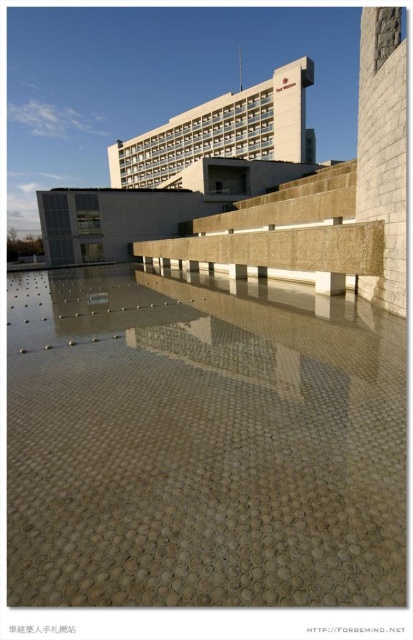
Can you confirm if translucent glass mosaic at center is wider than beige stone plaza at upper center?

No.

Is translucent glass mosaic at center smaller than beige stone plaza at upper center?

Correct, translucent glass mosaic at center occupies less space than beige stone plaza at upper center.

Where is `translucent glass mosaic at center`? The height and width of the screenshot is (640, 413). translucent glass mosaic at center is located at coordinates (199, 449).

Find the location of a particular element. translucent glass mosaic at center is located at coordinates (199, 449).